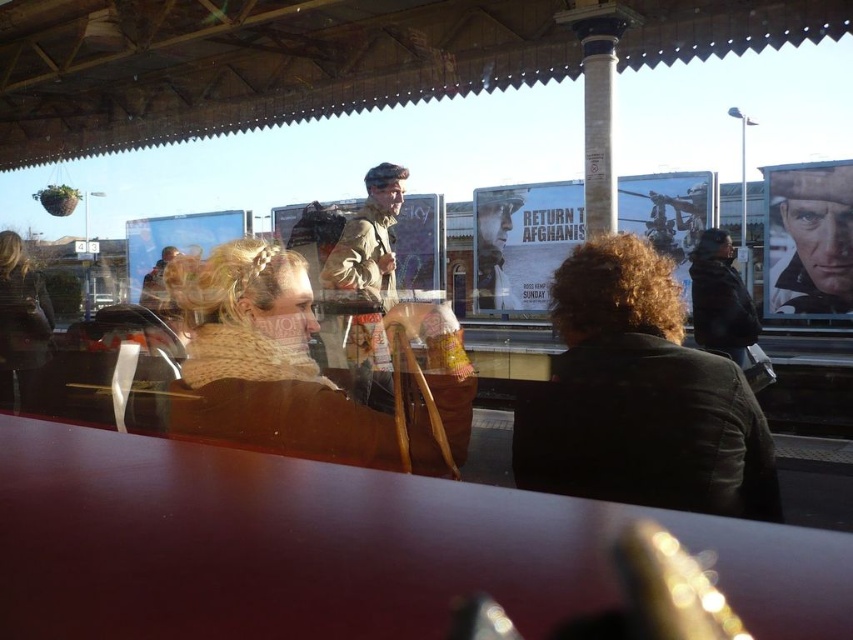
Question: Does smooth wood table at center appear on the right side of dark brown leather jacket at center?

Choices:
 (A) no
 (B) yes

Answer: (A)

Question: Which point is closer to the camera taking this photo?

Choices:
 (A) (250, 394)
 (B) (695, 428)
 (C) (730, 336)

Answer: (B)

Question: Which of these objects is positioned closest to the matte brown scarf at left?

Choices:
 (A) smooth leather jacket at upper right
 (B) dark brown fur coat at right

Answer: (B)

Question: Does knitted beige scarf at center appear on the left side of matte brown scarf at left?

Choices:
 (A) yes
 (B) no

Answer: (B)

Question: Which object appears farthest from the camera in this image?

Choices:
 (A) dark brown fur coat at right
 (B) smooth leather jacket at upper right
 (C) smooth wood table at center
 (D) matte brown scarf at left

Answer: (B)

Question: Is knitted beige scarf at center below camouflage fabric jacket at center?

Choices:
 (A) no
 (B) yes

Answer: (B)